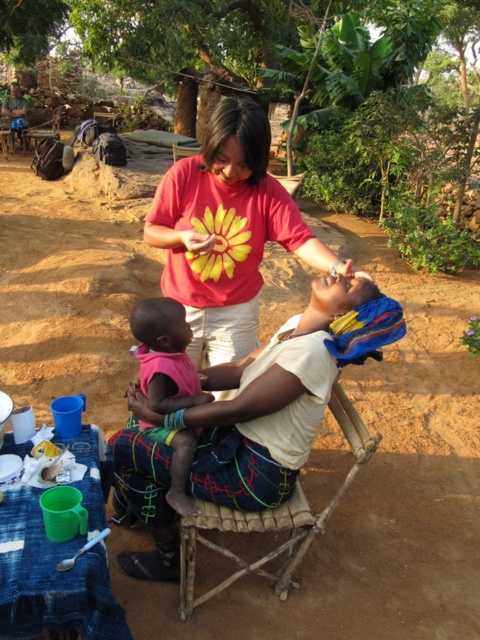
You are a medical professional trying to set up a temporary clinic in the described scene. There is a bamboo chair at center located at point (271, 518). Where should you place the first aid kit so that it is easily accessible but not in the way of the seated woman and child? Please provide coordinates based on the grid system described in the scene.

The bamboo chair at center is located at point (271, 518). To place the first aid kit in an accessible yet nonobstructive position, consider placing it near the chair but slightly to the side, such as at coordinates 0.85, 0.5. This position keeps it within reach of the seated woman while avoiding interference with her work area.